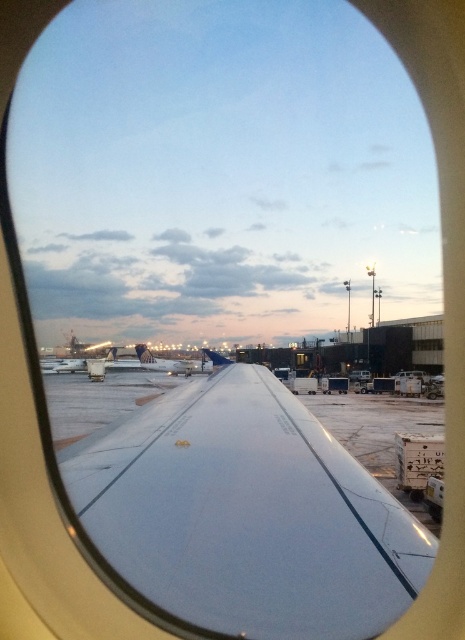
Which is in front, point (344, 616) or point (146, 360)?

Point (344, 616)

Does white glossy wing at center have a lesser height compared to white matte airplane at center?

Yes.

Describe the element at coordinates (246, 513) in the screenshot. I see `white glossy wing at center` at that location.

Locate an element on the screen. white glossy wing at center is located at coordinates (246, 513).